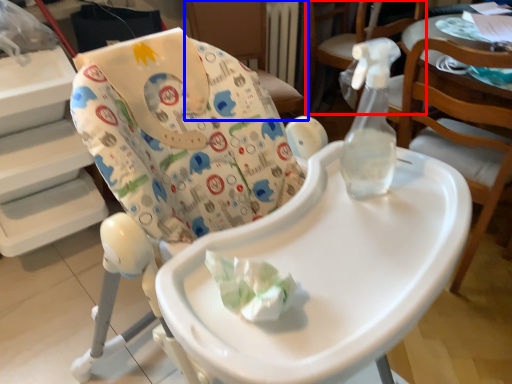
Question: Which object is closer to the camera taking this photo, chair (highlighted by a red box) or chair (highlighted by a blue box)?

Choices:
 (A) chair
 (B) chair

Answer: (A)